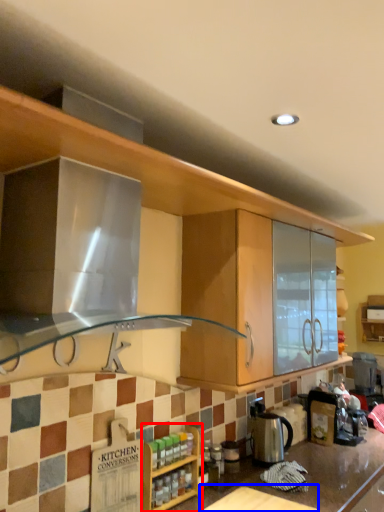
Question: Which of the following is the farthest to the observer, cabinetry (highlighted by a red box) or table (highlighted by a blue box)?

Choices:
 (A) cabinetry
 (B) table

Answer: (A)